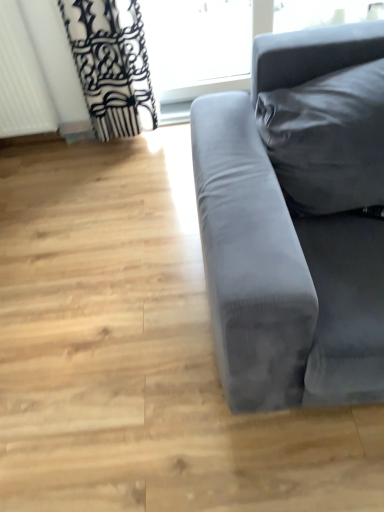
Find the location of a particular element. vacant space to the right of white textured radiator at left is located at coordinates (70, 148).